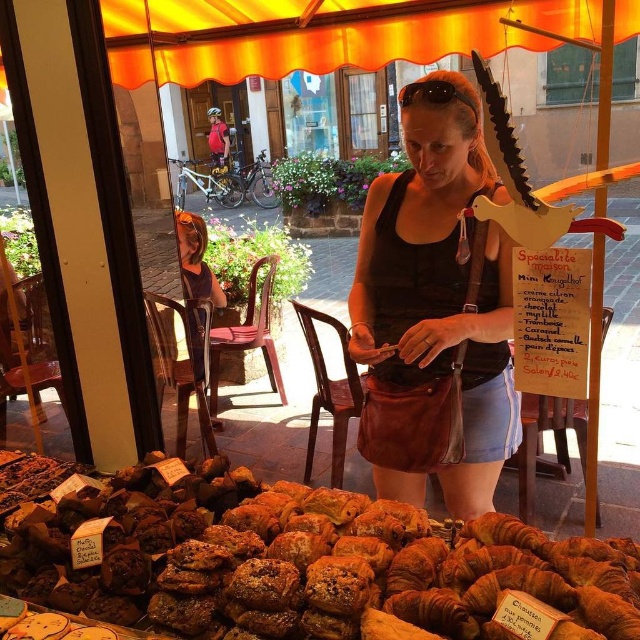
Between point (257, 508) and point (198, 244), which one is positioned in front?

Point (257, 508) is more forward.

Does point (76, 557) lie behind point (193, 285)?

No.

I want to click on golden brown croissant at center, so click(304, 563).

Who is higher up, golden brown croissant at center or matte black tank top at center?

Positioned higher is matte black tank top at center.

Is golden brown croissant at center wider than matte black tank top at center?

Yes.

The image size is (640, 640). What do you see at coordinates (304, 563) in the screenshot?
I see `golden brown croissant at center` at bounding box center [304, 563].

Image resolution: width=640 pixels, height=640 pixels. Find the location of `golden brown croissant at center`. golden brown croissant at center is located at coordinates (304, 563).

Is point (404, 234) farther from viewer compared to point (196, 234)?

No.

Is matte black tank top at center wider than orange fabric chair at lower left?

Incorrect, matte black tank top at center's width does not surpass orange fabric chair at lower left's.

Describe the element at coordinates (435, 307) in the screenshot. I see `matte black tank top at center` at that location.

The image size is (640, 640). I want to click on matte black tank top at center, so click(435, 307).